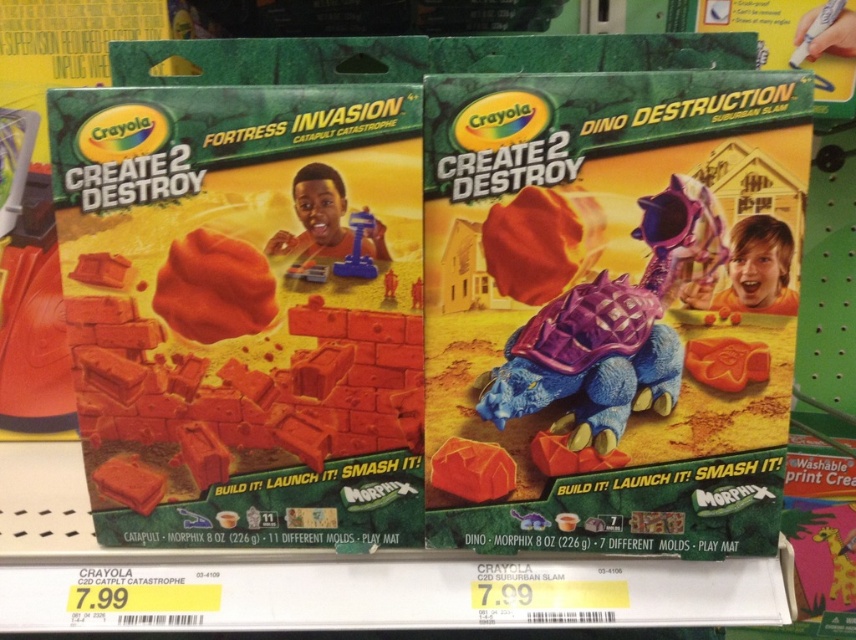
You are standing in front of the store shelf and want to touch the point at coordinates (354, 266) on the left package of the Crayola Create 2 Destroy playset. If your hand can reach up to 28 inches, will you be able to touch that point?

The point at (354, 266) is 28.35 inches away from the viewer. Since your hand can reach up to 28 inches, you will not be able to touch the point as it is slightly out of reach.

You are a child trying to decide between the two playsets. You want to know which object is smaller between the orange rubber dinosaur at center and the matte plastic catapult at center. Can you help me?

The orange rubber dinosaur at center is shorter than the matte plastic catapult at center, so the orange rubber dinosaur at center is the smaller object.